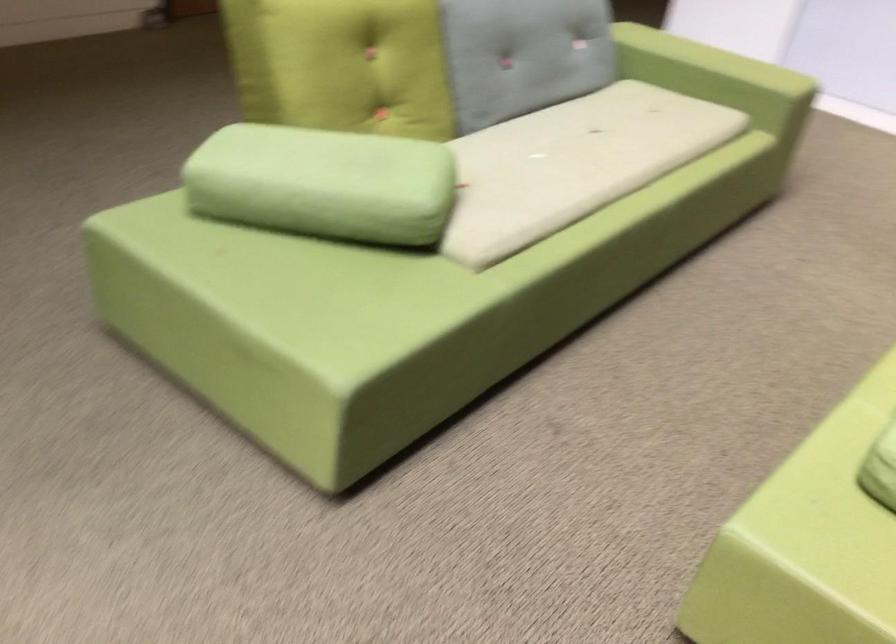
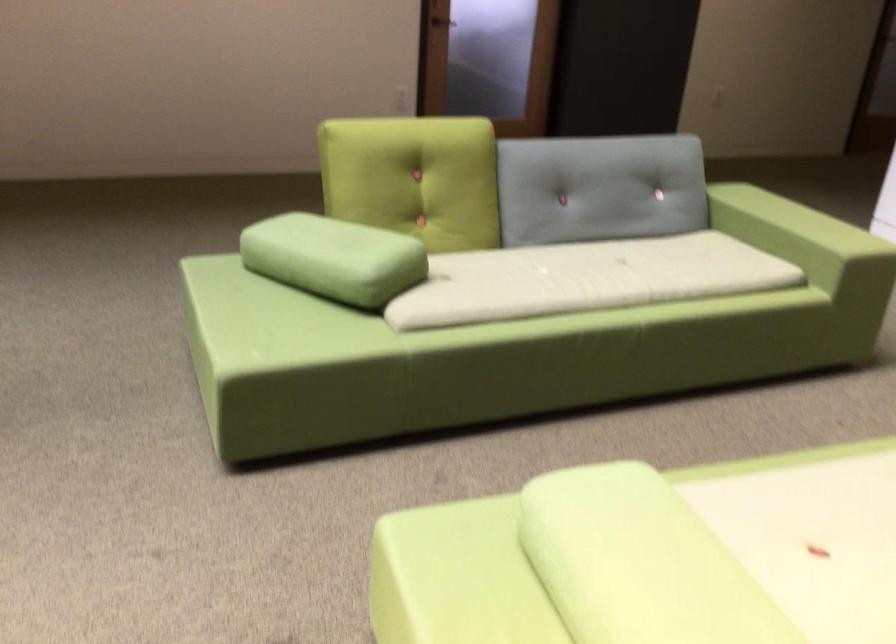
Where in the second image is the point corresponding to (x=576, y=243) from the first image?

(504, 334)